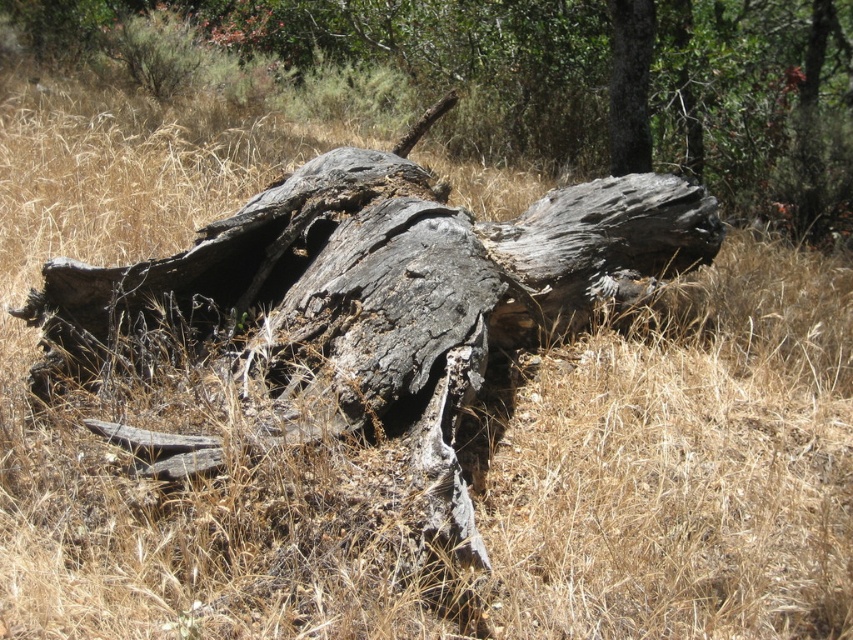
Identify the location of charred wood log at center. (401, 56).

Is point (750, 179) closer to viewer compared to point (641, 148)?

No, (750, 179) is behind (641, 148).

At what (x,y) coordinates should I click in order to perform the action: click on charred wood log at center. Please return your answer as a coordinate pair (x, y). The image size is (853, 640). Looking at the image, I should click on (401, 56).